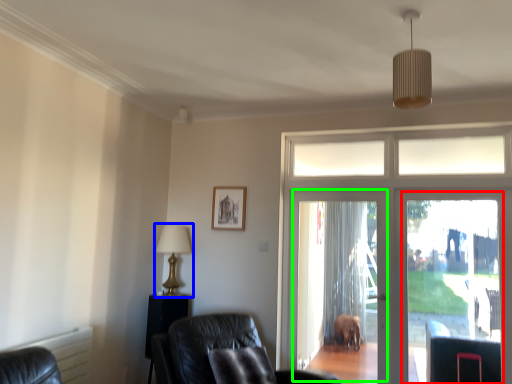
Question: Which object is the farthest from screen door (highlighted by a red box)? Choose among these: table lamp (highlighted by a blue box) or screen door (highlighted by a green box).

Choices:
 (A) table lamp
 (B) screen door

Answer: (A)